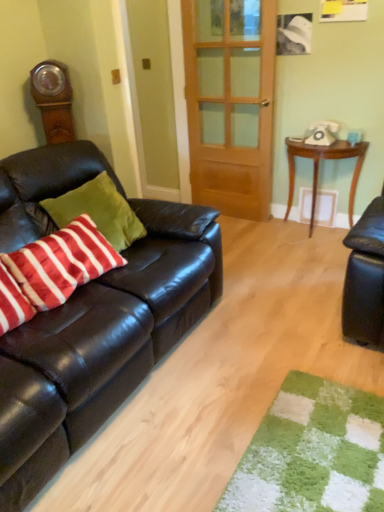
Question: Is velvety red and white striped pillow at left, which ranks as the 2th pillow in left-to-right order, inside wooden door at center?

Choices:
 (A) no
 (B) yes

Answer: (A)

Question: Is wooden door at center next to velvety red and white striped pillow at left, the first pillow viewed from the right, and touching it?

Choices:
 (A) yes
 (B) no

Answer: (B)

Question: From the image's perspective, is wooden door at center over velvety red and white striped pillow at left, the first pillow viewed from the right?

Choices:
 (A) yes
 (B) no

Answer: (A)

Question: Is wooden door at center not within velvety red and white striped pillow at left, which ranks as the 2th pillow in left-to-right order?

Choices:
 (A) yes
 (B) no

Answer: (A)

Question: Is wooden door at center smaller than velvety red and white striped pillow at left, the first pillow viewed from the right?

Choices:
 (A) no
 (B) yes

Answer: (A)

Question: Choose the correct answer: Is striped cotton pillow at left, positioned as the second pillow in right-to-left order, inside white plastic phone at upper right or outside it?

Choices:
 (A) inside
 (B) outside

Answer: (B)

Question: Considering the positions of point (19, 320) and point (307, 139), is point (19, 320) closer or farther from the camera than point (307, 139)?

Choices:
 (A) farther
 (B) closer

Answer: (B)

Question: From a real-world perspective, is striped cotton pillow at left, arranged as the first pillow when viewed from the left, positioned above or below white plastic phone at upper right?

Choices:
 (A) above
 (B) below

Answer: (B)

Question: Considering the positions of striped cotton pillow at left, positioned as the second pillow in right-to-left order, and white plastic phone at upper right in the image, is striped cotton pillow at left, positioned as the second pillow in right-to-left order, taller or shorter than white plastic phone at upper right?

Choices:
 (A) tall
 (B) short

Answer: (A)

Question: Considering the positions of velvety red and white striped pillow at left, which ranks as the 2th pillow in left-to-right order, and striped cotton pillow at left, arranged as the first pillow when viewed from the left, in the image, is velvety red and white striped pillow at left, which ranks as the 2th pillow in left-to-right order, bigger or smaller than striped cotton pillow at left, arranged as the first pillow when viewed from the left,?

Choices:
 (A) big
 (B) small

Answer: (A)

Question: From a real-world perspective, is velvety red and white striped pillow at left, which ranks as the 2th pillow in left-to-right order, above or below striped cotton pillow at left, positioned as the second pillow in right-to-left order?

Choices:
 (A) below
 (B) above

Answer: (A)

Question: From the image's perspective, is velvety red and white striped pillow at left, the first pillow viewed from the right, positioned above or below striped cotton pillow at left, positioned as the second pillow in right-to-left order?

Choices:
 (A) above
 (B) below

Answer: (A)

Question: Is velvety red and white striped pillow at left, which ranks as the 2th pillow in left-to-right order, situated inside striped cotton pillow at left, arranged as the first pillow when viewed from the left, or outside?

Choices:
 (A) outside
 (B) inside

Answer: (A)

Question: Is white plastic phone at upper right in front of or behind wooden door at center in the image?

Choices:
 (A) front
 (B) behind

Answer: (B)

Question: Considering the relative positions of white plastic phone at upper right and wooden door at center in the image provided, is white plastic phone at upper right to the left or to the right of wooden door at center?

Choices:
 (A) right
 (B) left

Answer: (A)